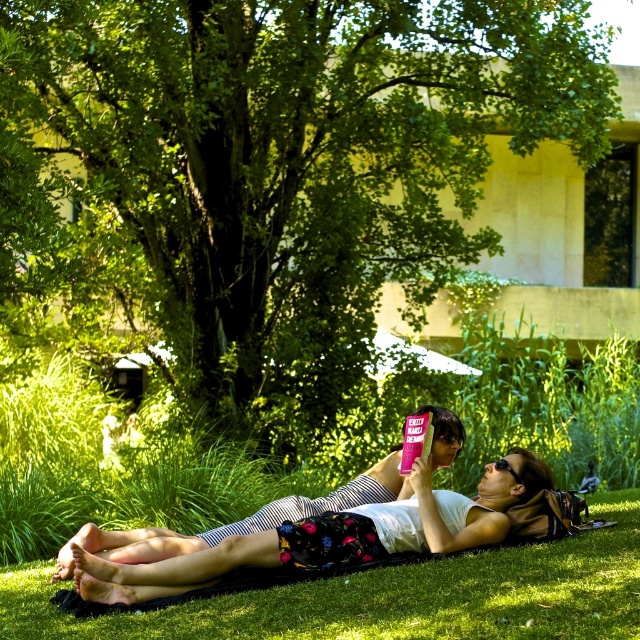
Question: Which of the following is the farthest from the observer?

Choices:
 (A) white cotton tank top at center
 (B) green leafy tree at center

Answer: (B)

Question: Estimate the real-world distances between objects in this image. Which object is closer to the green grass at lower center?

Choices:
 (A) green leafy tree at center
 (B) white cotton tank top at center

Answer: (B)

Question: Which of these objects is positioned farthest from the white cotton tank top at center?

Choices:
 (A) green grass at lower center
 (B) green leafy tree at center

Answer: (B)

Question: Does green leafy tree at center have a lesser width compared to green grass at lower center?

Choices:
 (A) yes
 (B) no

Answer: (A)

Question: In this image, where is green leafy tree at center located relative to white cotton tank top at center?

Choices:
 (A) left
 (B) right

Answer: (A)

Question: Is green grass at lower center further to the viewer compared to white cotton tank top at center?

Choices:
 (A) no
 (B) yes

Answer: (A)